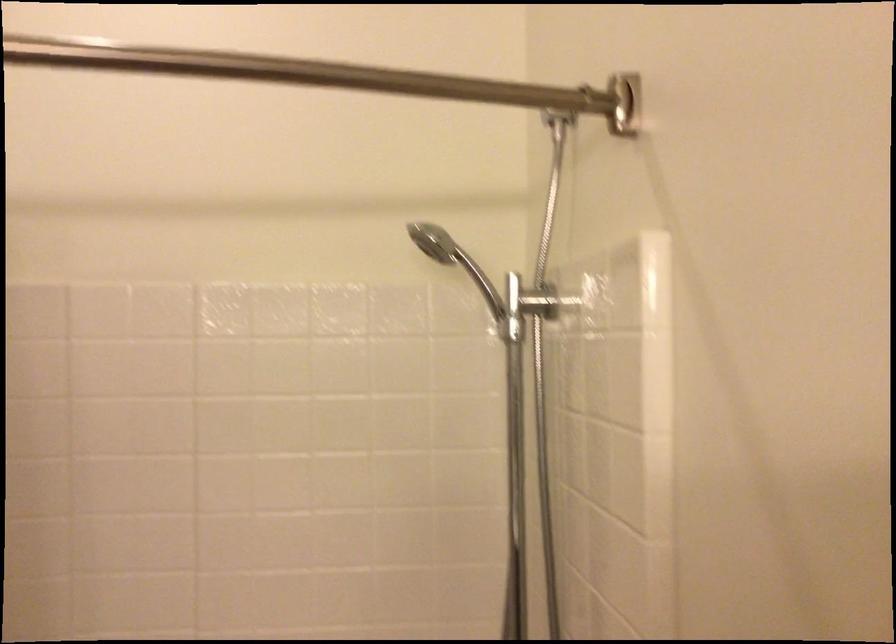
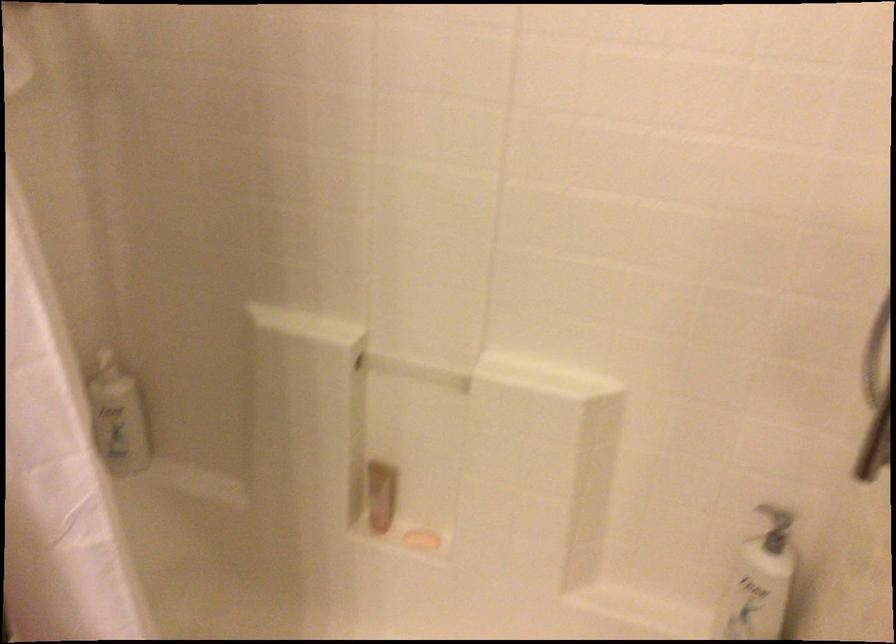
How did the camera likely rotate?

The camera's rotation is toward left-down.